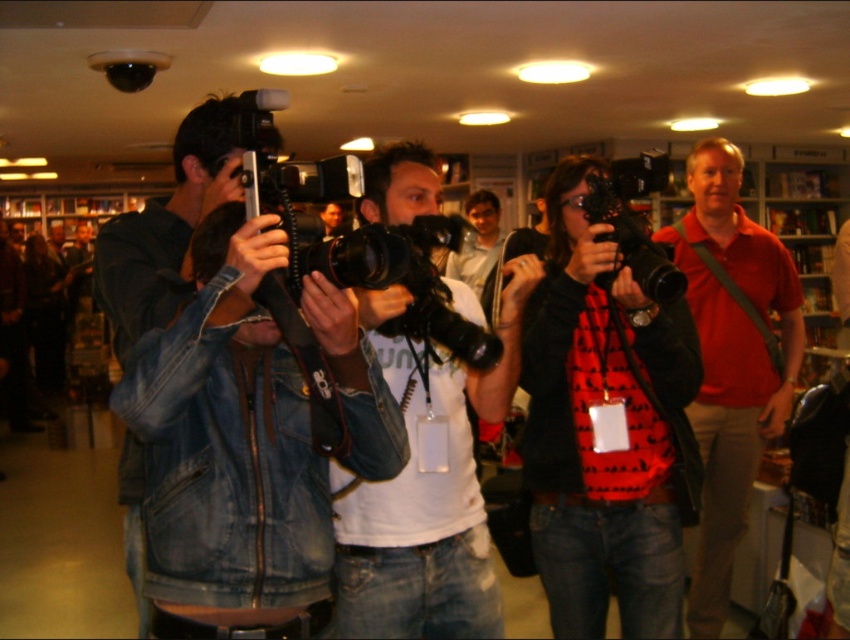
Can you confirm if matte black camera at center is smaller than white matte t-shirt at center?

A: Incorrect, matte black camera at center is not smaller in size than white matte t-shirt at center.

Between point (667, 467) and point (469, 605), which one is positioned behind?

The point (667, 467) is behind.

Image resolution: width=850 pixels, height=640 pixels. Describe the element at coordinates (595, 429) in the screenshot. I see `matte black camera at center` at that location.

Identify the location of matte black camera at center. This screenshot has height=640, width=850. (595, 429).

Identify the location of denim jacket at center. This screenshot has height=640, width=850. (227, 440).

Can you confirm if denim jacket at center is thinner than white matte t-shirt at center?

No.

Find the location of `denim jacket at center`. denim jacket at center is located at coordinates (227, 440).

Does denim jacket at center appear on the right side of matte red shirt at center?

No, denim jacket at center is not to the right of matte red shirt at center.

Is denim jacket at center positioned behind matte red shirt at center?

No, denim jacket at center is closer to the viewer.

Is point (255, 608) positioned behind point (703, 204)?

No.

Identify the location of denim jacket at center. The height and width of the screenshot is (640, 850). (227, 440).